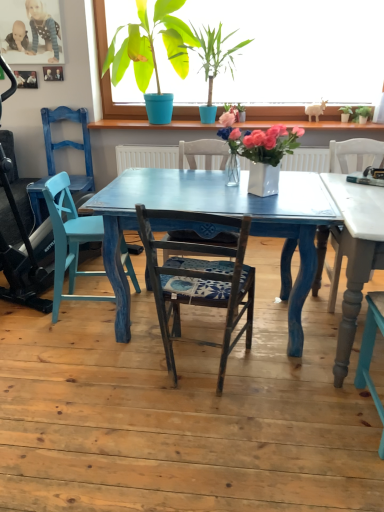
Question: Considering the positions of matte blue chair at left and white ceramic vase at center, the third houseplant positioned from the right, in the image, is matte blue chair at left taller or shorter than white ceramic vase at center, the third houseplant positioned from the right,?

Choices:
 (A) tall
 (B) short

Answer: (A)

Question: In the image, is matte blue chair at left positioned in front of or behind white ceramic vase at center, the third houseplant in the left-to-right sequence?

Choices:
 (A) behind
 (B) front

Answer: (A)

Question: Estimate the real-world distances between objects in this image. Which object is farther from the white ceramic vase at center, the third houseplant positioned from the right?

Choices:
 (A) wooden picture frame at upper left
 (B) green matte plant at upper center, the second houseplant viewed from the left
 (C) green matte plant at upper center, the 5th houseplant from the right
 (D) blue dotted dress at upper left
 (E) green matte plant at upper right, which is the 4th houseplant from left to right

Answer: (A)

Question: Estimate the real-world distances between objects in this image. Which object is farther from the green leafy plant at upper center, which is counted as the first houseplant, starting from the right?

Choices:
 (A) matte blue chair at left
 (B) wooden picture frame at upper left
 (C) wooden chair with cushion at center
 (D) matte blue swivel chair at left
 (E) white ceramic vase at center, the third houseplant in the left-to-right sequence

Answer: (B)